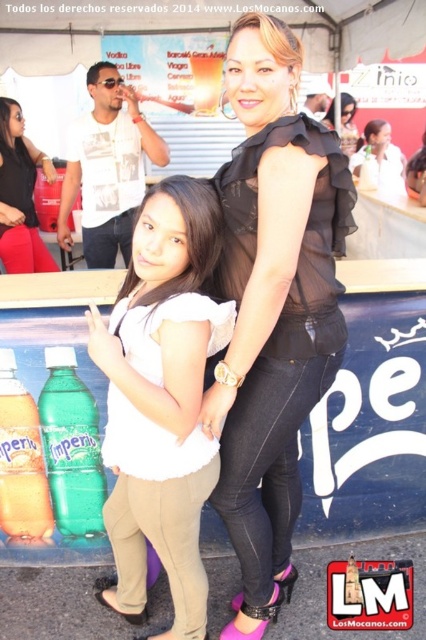
Question: Does matte black top at upper center come behind smooth white blouse at center?

Choices:
 (A) yes
 (B) no

Answer: (A)

Question: Which object is closer to the camera taking this photo?

Choices:
 (A) matte black top at upper center
 (B) smooth white blouse at center

Answer: (B)

Question: Is the position of black sheer blouse at center more distant than that of smooth white blouse at center?

Choices:
 (A) no
 (B) yes

Answer: (A)

Question: Estimate the real-world distances between objects in this image. Which object is farther from the matte black top at upper center?

Choices:
 (A) white matte blouse at center
 (B) green plastic bottle at center

Answer: (A)

Question: Is green plastic bottle at center positioned before smooth white blouse at center?

Choices:
 (A) yes
 (B) no

Answer: (B)

Question: Among these points, which one is farthest from the camera?

Choices:
 (A) (100, 500)
 (B) (368, 177)

Answer: (B)